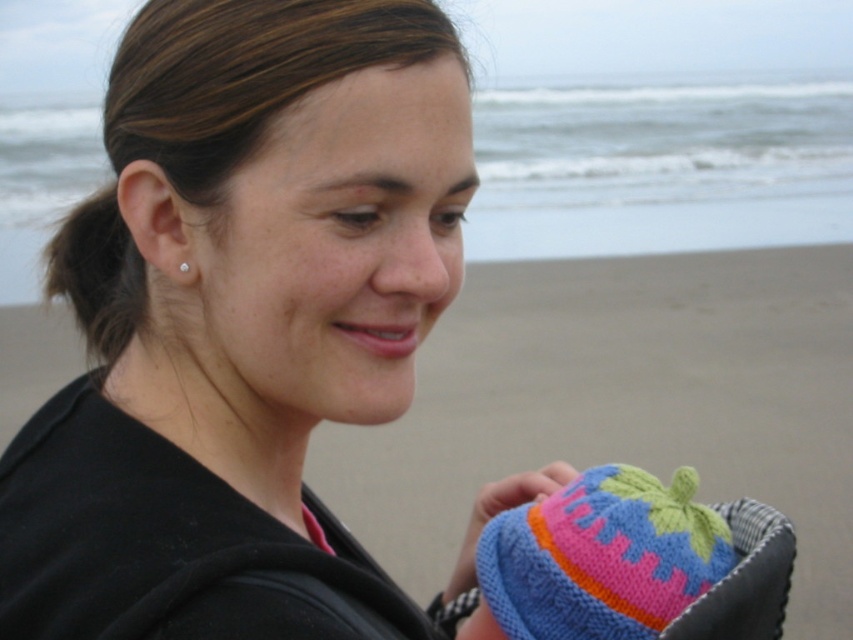
Can you confirm if sandy beach at lower right is taller than pearl earring at ear?

Yes.

Does sandy beach at lower right have a larger size compared to pearl earring at ear?

Yes.

Which is in front, point (546, 298) or point (184, 268)?

Point (184, 268) is in front.

The image size is (853, 640). Find the location of `sandy beach at lower right`. sandy beach at lower right is located at coordinates (622, 403).

Is black fabric at center further to the viewer compared to pearl earring at ear?

No.

Is point (318, 182) farther from viewer compared to point (181, 272)?

No, it is in front of (181, 272).

Between point (276, 90) and point (187, 266), which one is positioned behind?

Point (187, 266)

The image size is (853, 640). What are the coordinates of `black fabric at center` in the screenshot? It's located at (236, 312).

Between black fabric at center and knitted fabric baby hat at lower right, which one is positioned lower?

knitted fabric baby hat at lower right is below.

Does black fabric at center have a lesser height compared to knitted fabric baby hat at lower right?

No.

Which is in front, point (439, 17) or point (456, 573)?

Point (439, 17)

Where is `black fabric at center`? The width and height of the screenshot is (853, 640). black fabric at center is located at coordinates 236,312.